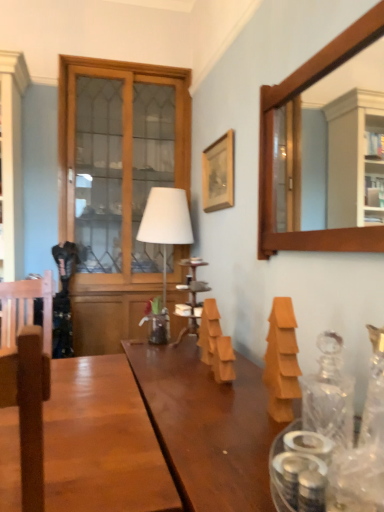
Locate an element on the screen. The width and height of the screenshot is (384, 512). blank space situated above wooden frame mirror at upper right (from a real-world perspective) is located at coordinates (320, 40).